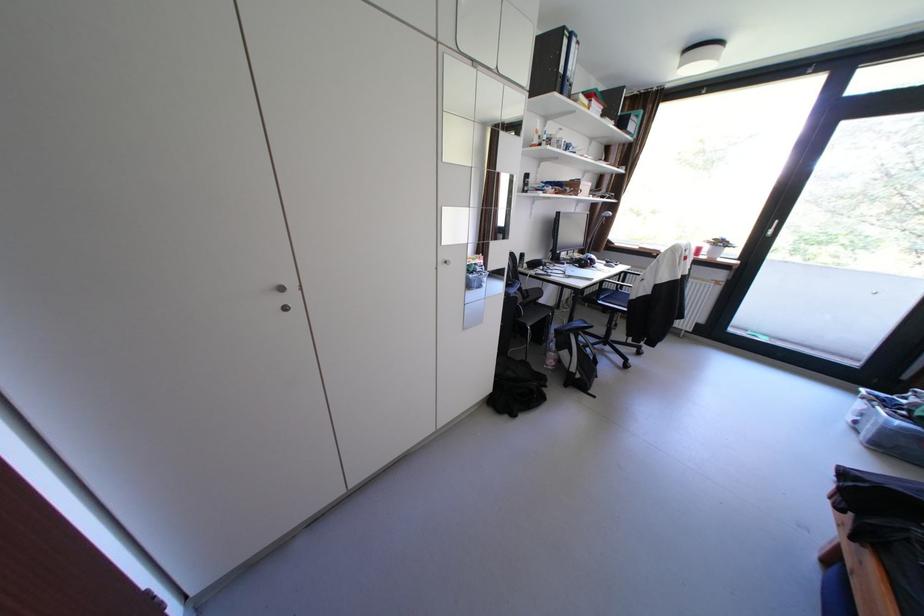
I want to click on chair armrest, so click(613, 302).